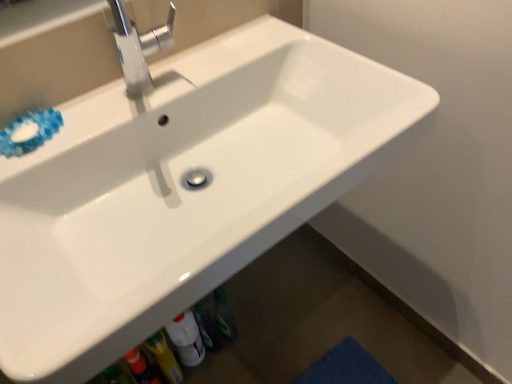
Question: Considering the relative sizes of white glossy bottle at lower center and polished metallic faucet at upper center in the image provided, is white glossy bottle at lower center shorter than polished metallic faucet at upper center?

Choices:
 (A) yes
 (B) no

Answer: (B)

Question: Is white glossy bottle at lower center looking in the opposite direction of polished metallic faucet at upper center?

Choices:
 (A) no
 (B) yes

Answer: (A)

Question: Does white glossy bottle at lower center have a greater height compared to polished metallic faucet at upper center?

Choices:
 (A) no
 (B) yes

Answer: (B)

Question: From a real-world perspective, is white glossy bottle at lower center physically below polished metallic faucet at upper center?

Choices:
 (A) yes
 (B) no

Answer: (A)

Question: Does white glossy bottle at lower center have a smaller size compared to polished metallic faucet at upper center?

Choices:
 (A) yes
 (B) no

Answer: (A)

Question: Could you tell me if white glossy bottle at lower center is facing polished metallic faucet at upper center?

Choices:
 (A) no
 (B) yes

Answer: (A)

Question: Is the position of polished metallic faucet at upper center more distant than that of white glossy bottle at lower center?

Choices:
 (A) yes
 (B) no

Answer: (B)

Question: From a real-world perspective, is polished metallic faucet at upper center positioned over white glossy bottle at lower center based on gravity?

Choices:
 (A) no
 (B) yes

Answer: (B)

Question: Is polished metallic faucet at upper center smaller than white glossy bottle at lower center?

Choices:
 (A) no
 (B) yes

Answer: (A)

Question: Can you confirm if polished metallic faucet at upper center is positioned to the left of white glossy bottle at lower center?

Choices:
 (A) no
 (B) yes

Answer: (B)

Question: Is the depth of polished metallic faucet at upper center less than that of white glossy bottle at lower center?

Choices:
 (A) no
 (B) yes

Answer: (B)

Question: Is polished metallic faucet at upper center oriented towards white glossy bottle at lower center?

Choices:
 (A) yes
 (B) no

Answer: (B)

Question: Based on their sizes in the image, would you say polished metallic faucet at upper center is bigger or smaller than white glossy bottle at lower center?

Choices:
 (A) small
 (B) big

Answer: (B)